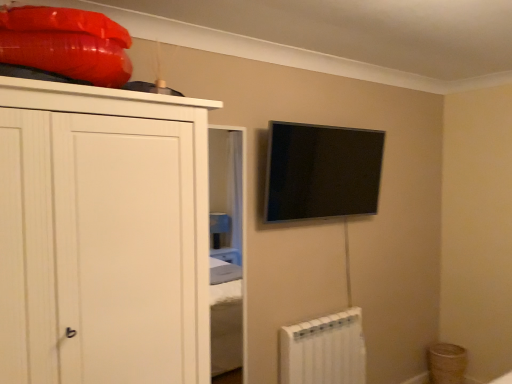
Identify the location of white plastic radiator at lower right. This screenshot has height=384, width=512. (324, 350).

Image resolution: width=512 pixels, height=384 pixels. What do you see at coordinates (324, 350) in the screenshot?
I see `white plastic radiator at lower right` at bounding box center [324, 350].

Find the location of a particular element. The image size is (512, 384). white plastic radiator at lower right is located at coordinates tap(324, 350).